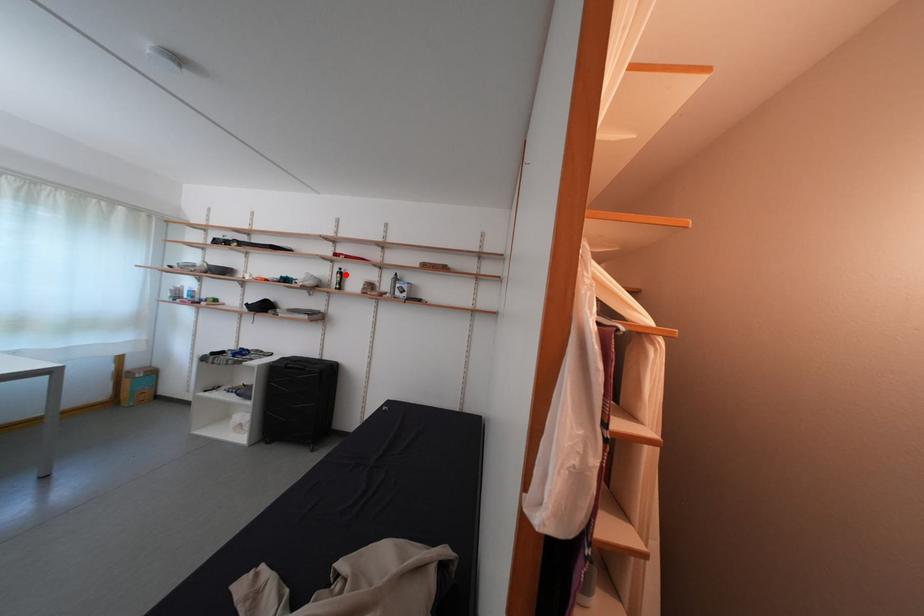
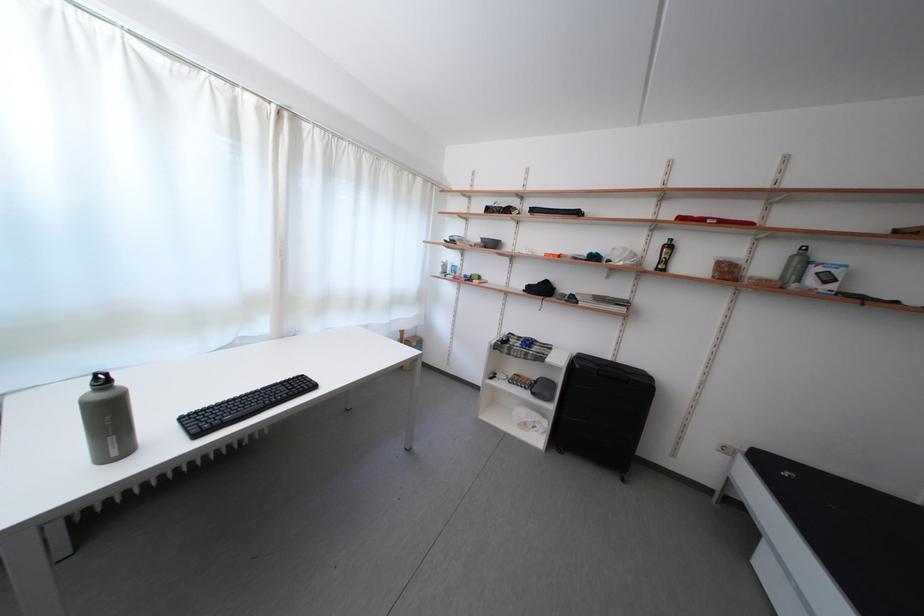
Locate, in the second image, the point that corresponds to the highlighted location in the first image.

(669, 246)